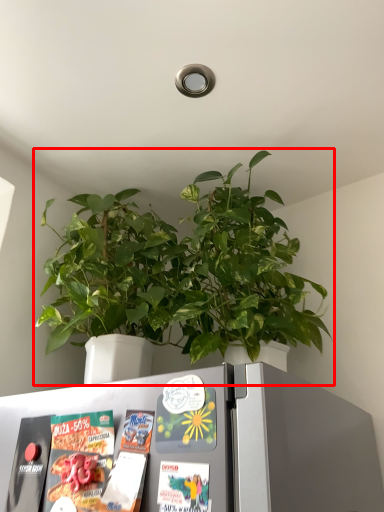
Question: From the image's perspective, what is the correct spatial positioning of houseplant (annotated by the red box) in reference to refrigerator?

Choices:
 (A) below
 (B) above

Answer: (B)